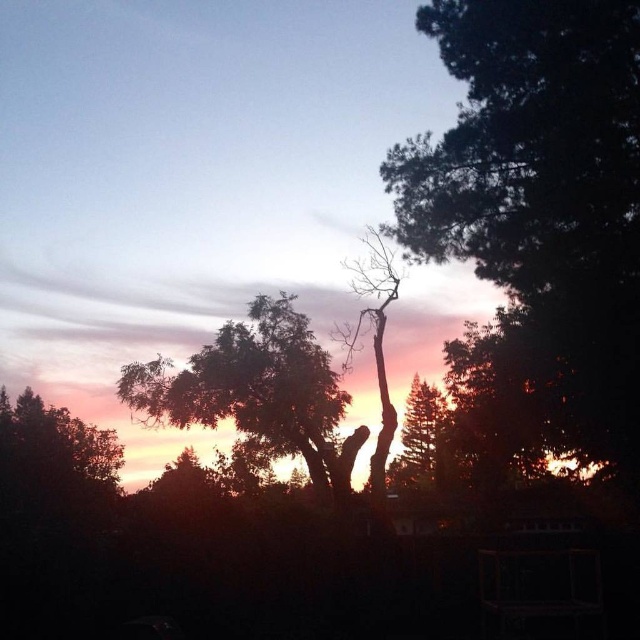
You are a photographer who wants to capture the silhouette bare tree at center and the smooth bark tree at center in a single shot. Based on their positions, which tree will appear closer to the camera in the photo?

The silhouette bare tree at center will appear closer to the camera because it is positioned in front of the smooth bark tree at center.

From the picture: You are an artist planning to paint this sunset scene. You want to ensure the dark green textured tree at right and the smooth bark tree at center are proportionally accurate. Which tree should you make wider in your painting?

The dark green textured tree at right might be wider than smooth bark tree at center according to the scene description.